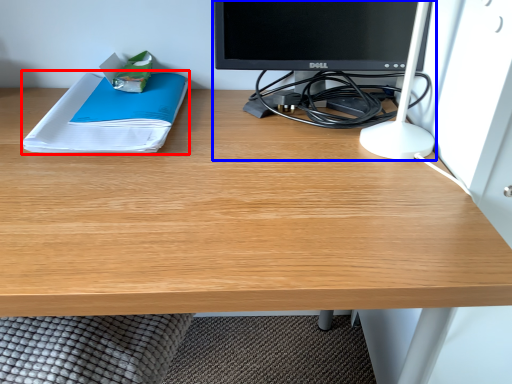
Question: Which of the following is the farthest to the observer, paperback book (highlighted by a red box) or desktop computer (highlighted by a blue box)?

Choices:
 (A) paperback book
 (B) desktop computer

Answer: (A)